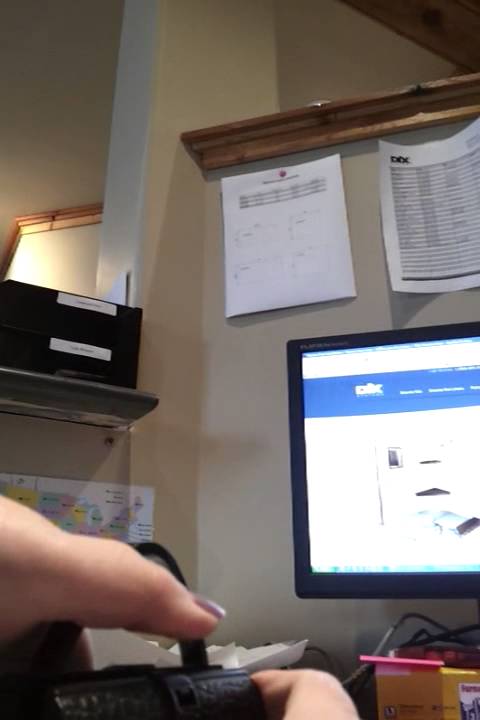
Locate an element on the screen. molding is located at coordinates (52, 222).